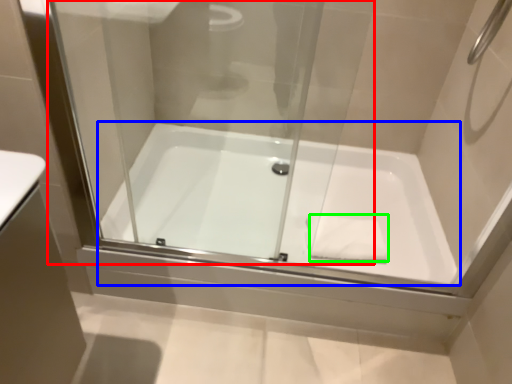
Question: Considering the real-world distances, which object is farthest from glass door (highlighted by a red box)? bathtub (highlighted by a blue box) or hand towel (highlighted by a green box)?

Choices:
 (A) bathtub
 (B) hand towel

Answer: (B)